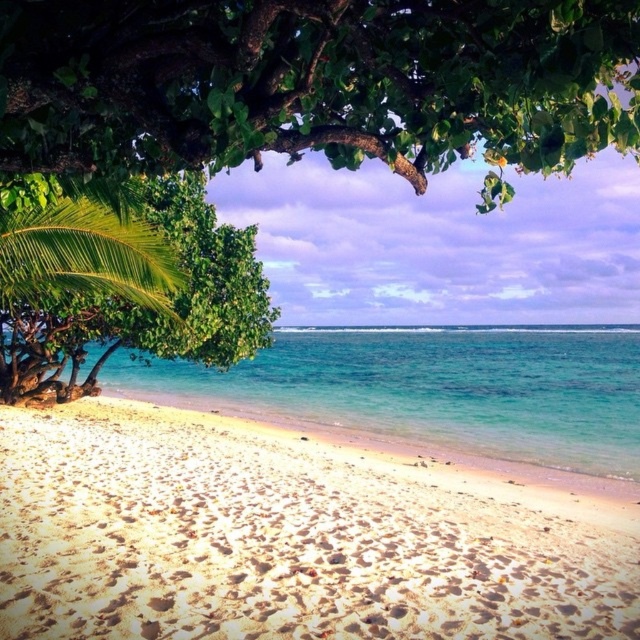
You are standing at the beach and want to take a photo of the green leafy tree at upper center. Your camera has a maximum focus range of 2 meters. Will the tree be in focus?

The distance between the green leafy tree at upper center and the camera is 2.29 meters, which exceeds the camera maximum focus range of 2 meters. Therefore, the tree will not be in focus.

You are standing on the beach and see the green leafy tree at upper center and the green leafy palm tree at upper left. Which tree is closer to the left edge of the beach scene?

The green leafy palm tree at upper left is closer to the left edge of the beach scene because it is positioned to the left of the green leafy tree at upper center.

You are standing at the edge of the beach and want to reach the water as quickly as possible. Which direction should you walk to get to the ocean from the white sandy beach at lower center?

Since the white sandy beach at lower center is 5.65 meters away from you, you should walk directly towards the ocean in the direction of the white sandy beach at lower center to reach the water quickly.